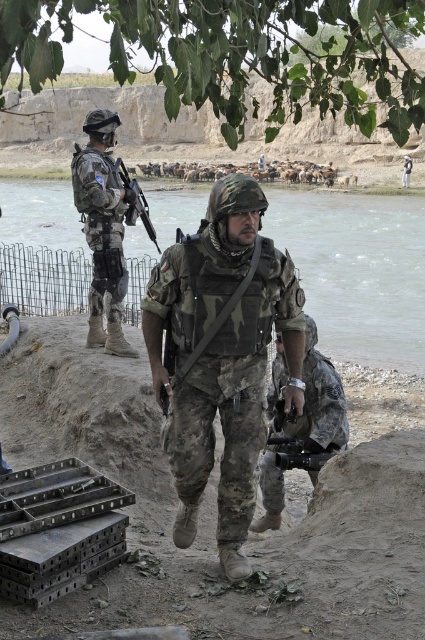
Question: Does clear water at river right appear on the left side of camouflage fabric uniform at left?

Choices:
 (A) no
 (B) yes

Answer: (A)

Question: Where is camouflage fabric uniform at center located in relation to camouflage fabric uniform at left in the image?

Choices:
 (A) right
 (B) left

Answer: (A)

Question: Does camouflage fabric helmet at center have a larger size compared to black plastic rifle at upper center?

Choices:
 (A) yes
 (B) no

Answer: (B)

Question: Which point is closer to the camera taking this photo?

Choices:
 (A) (116, 339)
 (B) (300, 362)
 (C) (144, 248)

Answer: (B)

Question: Which point is closer to the camera?

Choices:
 (A) black plastic rifle at upper center
 (B) camouflage uniform at center
 (C) camouflage fabric uniform at center

Answer: (C)

Question: Which is farther from the clear water at river right?

Choices:
 (A) camouflage fabric helmet at center
 (B) camouflage fabric uniform at center

Answer: (B)